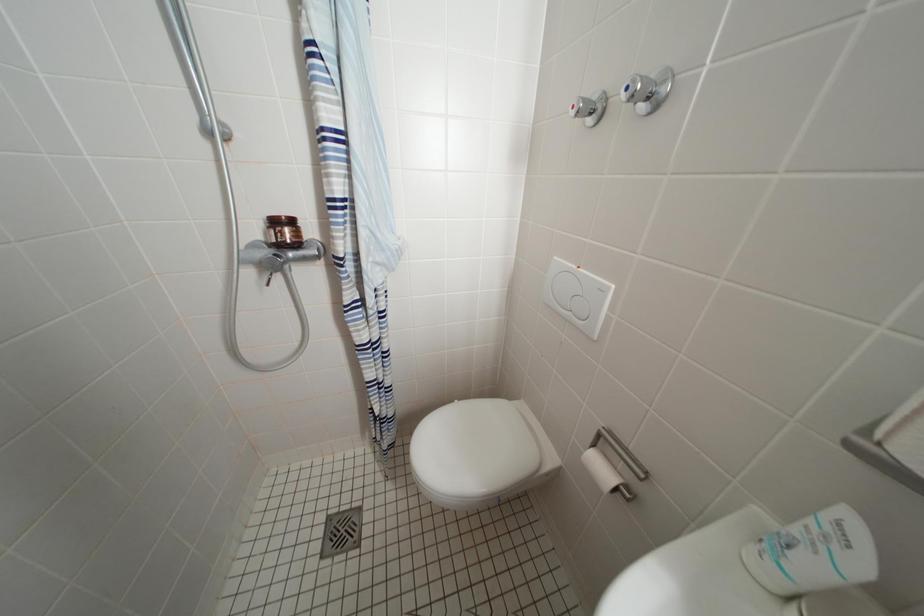
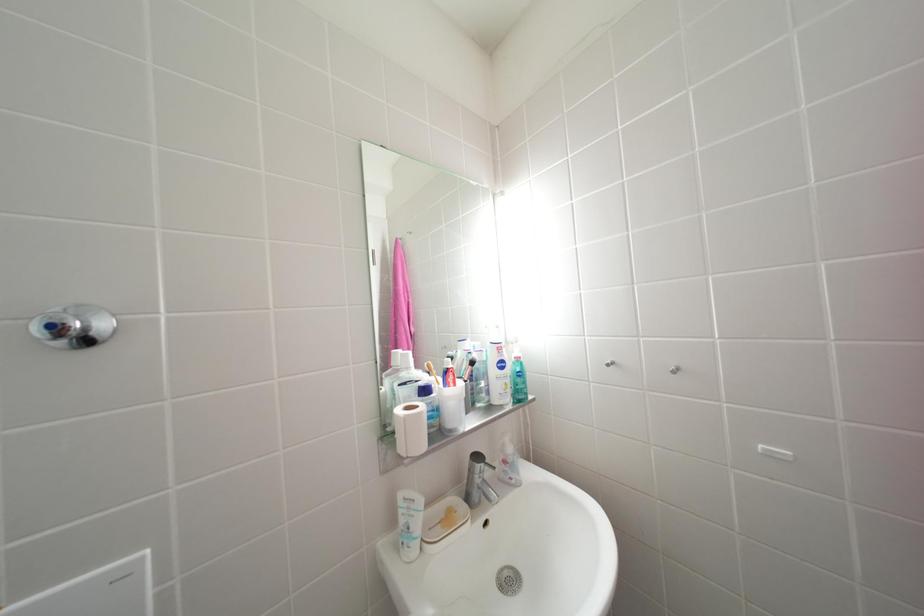
Question: Based on the continuous images, in which direction is the camera rotating? Reply with the corresponding letter.

Choices:
 (A) Left
 (B) Right
 (C) Up
 (D) Down

Answer: (B)